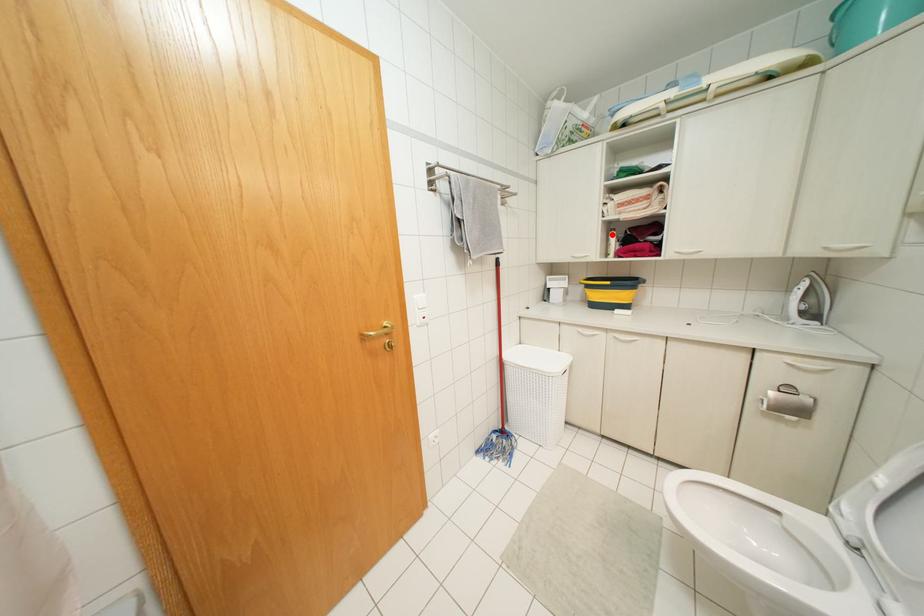
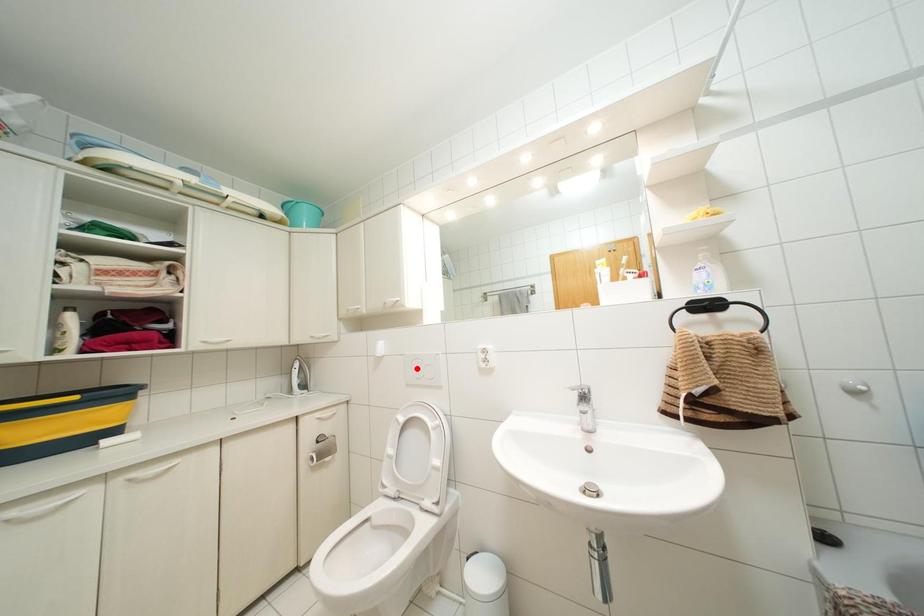
I am providing you with two images of the same scene from different viewpoints. A red point is marked on the first image and another point is marked on the second image. Are the points marked in image1 and image2 representing the same 3D position?

No